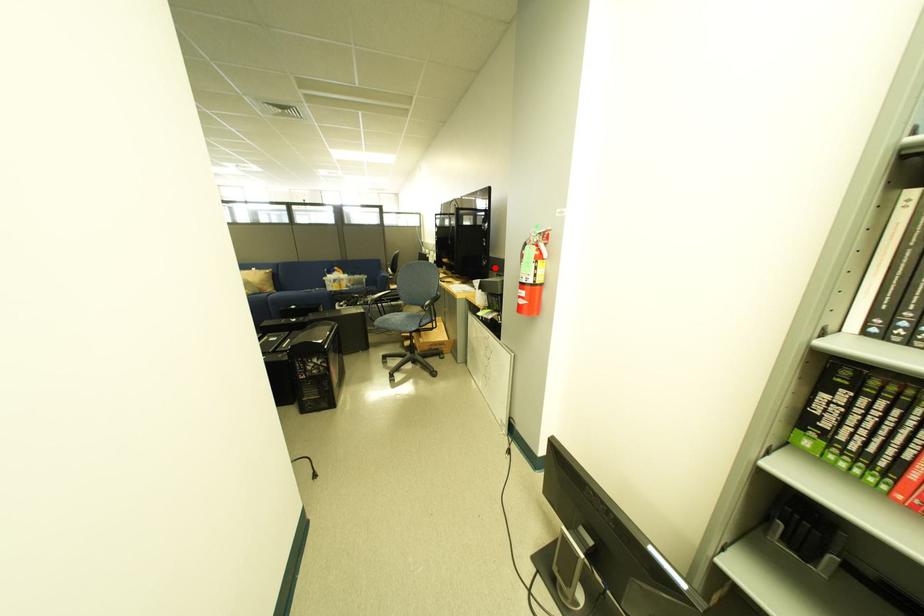
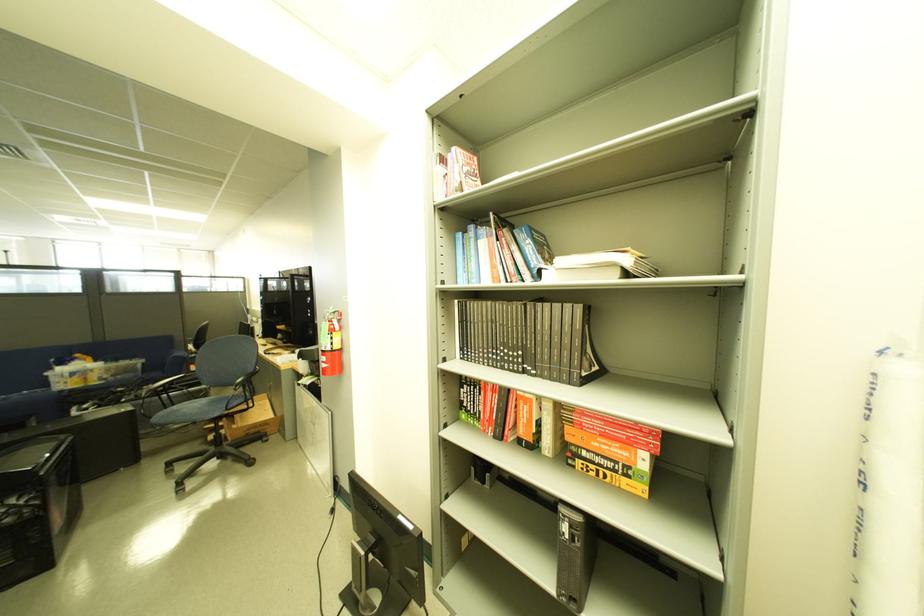
Locate, in the second image, the point that corresponds to the highlighted location in the first image.

(322, 336)